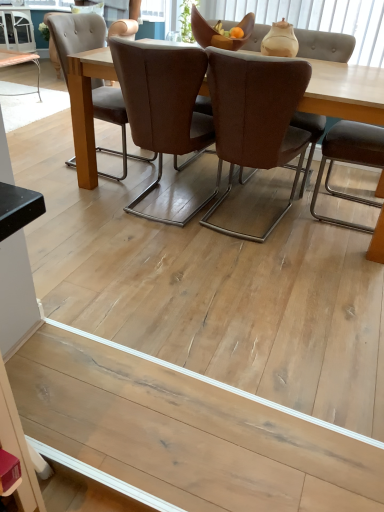
Question: From a real-world perspective, relative to natural wood floor at lower center, is matte beige vase at upper center vertically above or below?

Choices:
 (A) below
 (B) above

Answer: (B)

Question: Is matte beige vase at upper center to the left or to the right of natural wood floor at lower center in the image?

Choices:
 (A) left
 (B) right

Answer: (B)

Question: Based on their relative distances, which object is nearer to the brown fabric chair at center, which ranks as the 2th chair in right-to-left order?

Choices:
 (A) natural wood floor at lower center
 (B) brown leather chair at center, which ranks as the first chair in left-to-right order
 (C) matte beige vase at upper center
 (D) white glossy cabinet at upper left
 (E) brown leather chair at right, marked as the third chair in a left-to-right arrangement

Answer: (B)

Question: Based on their relative distances, which object is farther from the white glossy cabinet at upper left?

Choices:
 (A) brown fabric chair at center, which ranks as the 2th chair in right-to-left order
 (B) natural wood floor at lower center
 (C) brown leather chair at center, positioned as the 3th chair in right-to-left order
 (D) matte beige vase at upper center
 (E) brown leather chair at right, marked as the third chair in a left-to-right arrangement

Answer: (B)